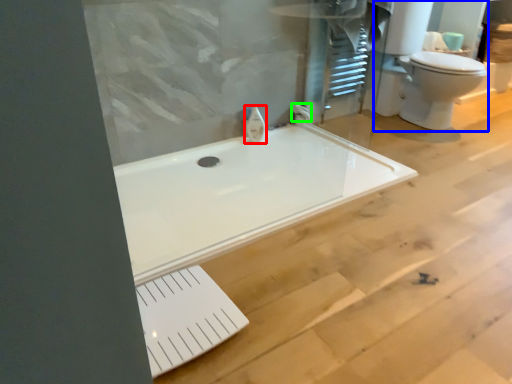
Question: Which object is positioned farthest from faucet (highlighted by a red box)? Select from sink (highlighted by a blue box) and faucet (highlighted by a green box).

Choices:
 (A) sink
 (B) faucet

Answer: (A)